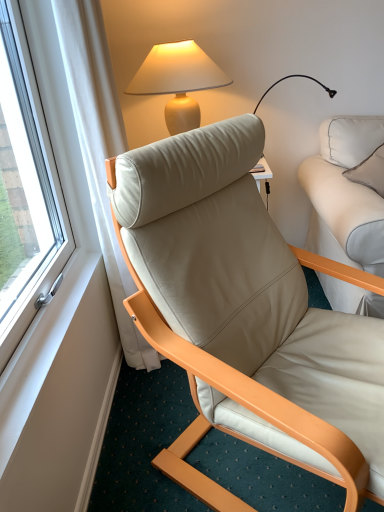
Question: From a real-world perspective, is white leather pillow at upper right positioned over beige leather chair at center based on gravity?

Choices:
 (A) no
 (B) yes

Answer: (B)

Question: From the image's perspective, does white leather pillow at upper right appear higher than beige leather chair at center?

Choices:
 (A) yes
 (B) no

Answer: (A)

Question: Can you confirm if white leather pillow at upper right is positioned to the left of beige leather chair at center?

Choices:
 (A) yes
 (B) no

Answer: (B)

Question: From a real-world perspective, is white leather pillow at upper right below beige leather chair at center?

Choices:
 (A) no
 (B) yes

Answer: (A)

Question: Considering the relative sizes of white leather pillow at upper right and beige leather chair at center in the image provided, is white leather pillow at upper right thinner than beige leather chair at center?

Choices:
 (A) no
 (B) yes

Answer: (B)

Question: In terms of width, does matte beige lamp at upper center look wider or thinner when compared to white leather pillow at upper right?

Choices:
 (A) thin
 (B) wide

Answer: (B)

Question: Would you say matte beige lamp at upper center is to the left or to the right of white leather pillow at upper right in the picture?

Choices:
 (A) right
 (B) left

Answer: (B)

Question: From a real-world perspective, is matte beige lamp at upper center above or below white leather pillow at upper right?

Choices:
 (A) above
 (B) below

Answer: (A)

Question: Is point (178, 96) positioned closer to the camera than point (375, 134)?

Choices:
 (A) closer
 (B) farther

Answer: (B)

Question: Is white leather pillow at upper right to the left or to the right of beige leather chair at center in the image?

Choices:
 (A) left
 (B) right

Answer: (B)

Question: Based on their sizes in the image, would you say white leather pillow at upper right is bigger or smaller than beige leather chair at center?

Choices:
 (A) small
 (B) big

Answer: (A)

Question: From the image's perspective, is white leather pillow at upper right above or below beige leather chair at center?

Choices:
 (A) below
 (B) above

Answer: (B)

Question: Looking at their shapes, would you say white leather pillow at upper right is wider or thinner than beige leather chair at center?

Choices:
 (A) wide
 (B) thin

Answer: (B)

Question: In terms of size, does beige leather chair at center appear bigger or smaller than matte beige lamp at upper center?

Choices:
 (A) small
 (B) big

Answer: (B)

Question: From the image's perspective, is beige leather chair at center located above or below matte beige lamp at upper center?

Choices:
 (A) above
 (B) below

Answer: (B)